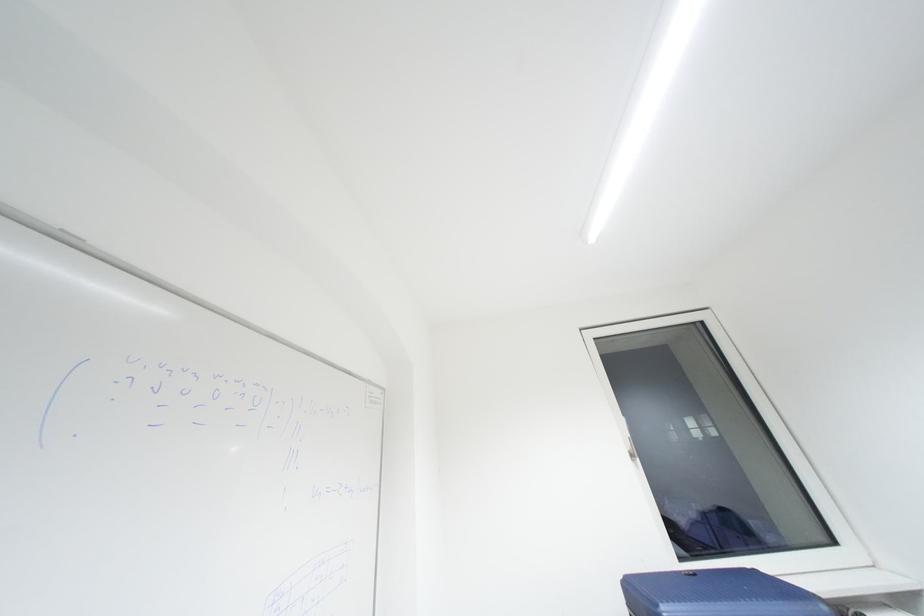
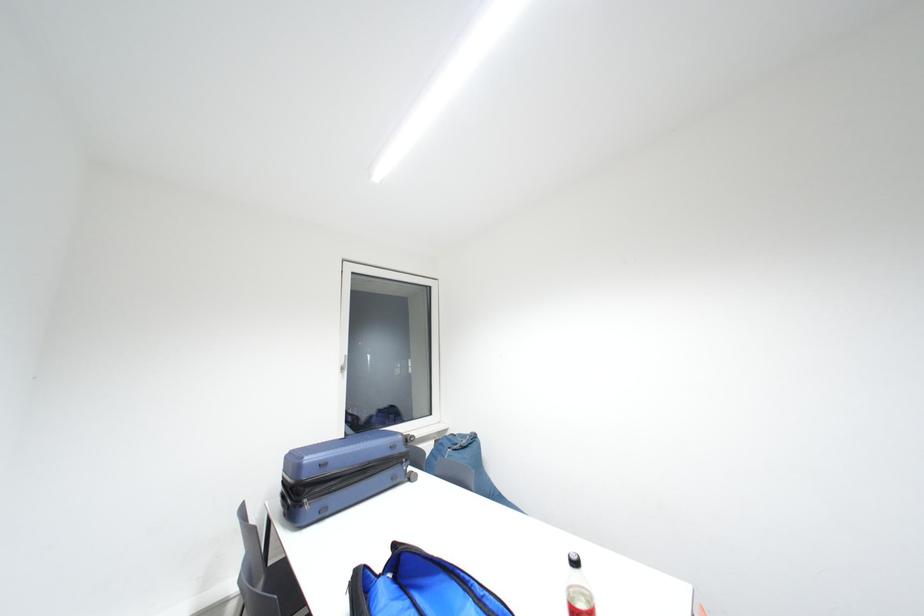
Question: The first image is from the beginning of the video and the second image is from the end. How did the camera likely rotate when shooting the video?

Choices:
 (A) Left
 (B) Right
 (C) Up
 (D) Down

Answer: (B)